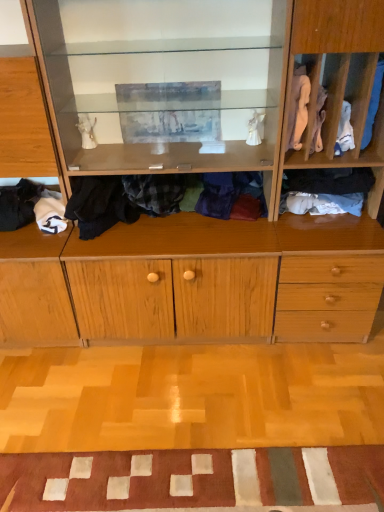
Question: Looking at the image, does wooden cabinet at center, which is the 1th cabinetry in right-to-left order, seem bigger or smaller compared to soft white fabric at lower left, which appears as the 1th clothing when viewed from the left?

Choices:
 (A) big
 (B) small

Answer: (A)

Question: Do you think wooden cabinet at center, which is the 1th cabinetry in right-to-left order, is within soft white fabric at lower left, which appears as the 1th clothing when viewed from the left, or outside of it?

Choices:
 (A) outside
 (B) inside

Answer: (A)

Question: Which object is the closest to the white cotton socks at right, which appears as the 2th clothing when viewed from the right?

Choices:
 (A) light wood cabinet at left, marked as the first cabinetry in a left-to-right arrangement
 (B) patchwork fabric doormat at lower center
 (C) wooden cabinet at center, which is the second cabinetry in left-to-right order
 (D) dark blue fabric at right, the fourth clothing in the left-to-right sequence
 (E) blue cotton socks at right, arranged as the 1th clothing when viewed from the right

Answer: (D)

Question: Estimate the real-world distances between objects in this image. Which object is farther from the patchwork fabric doormat at lower center?

Choices:
 (A) light wood cabinet at left, the second cabinetry in the right-to-left sequence
 (B) soft white fabric at lower left, the sixth clothing positioned from the right
 (C) blue cotton socks at right, arranged as the 1th clothing when viewed from the right
 (D) dark blue fabric at right, which appears as the third clothing when viewed from the right
 (E) flannel shirt at center, the second clothing when ordered from left to right

Answer: (C)